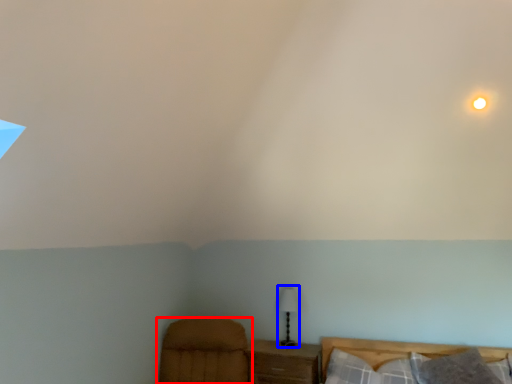
Question: Among these objects, which one is nearest to the camera, furniture (highlighted by a red box) or table lamp (highlighted by a blue box)?

Choices:
 (A) furniture
 (B) table lamp

Answer: (A)